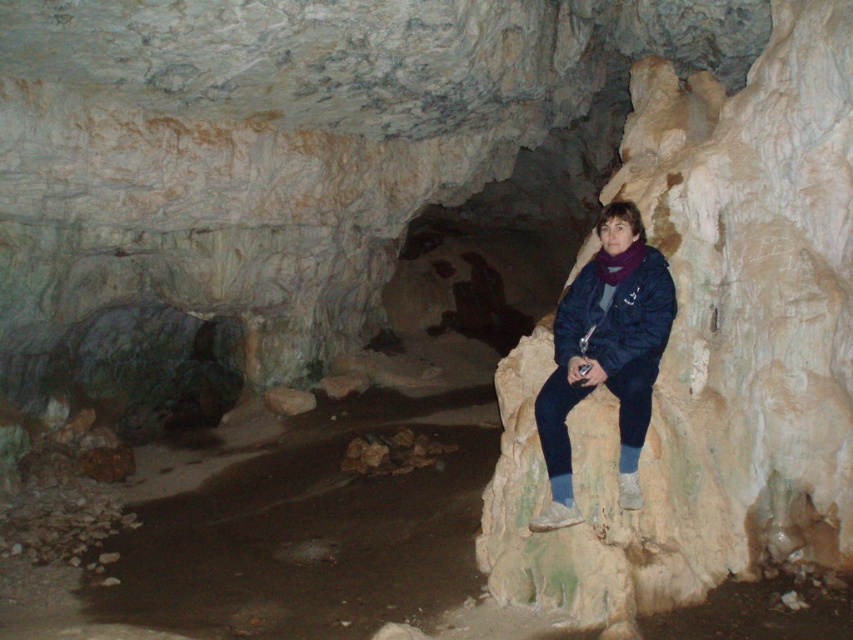
Question: Does dark blue jacket at center appear on the right side of dark blue fleece at center?

Choices:
 (A) no
 (B) yes

Answer: (A)

Question: Is dark blue jacket at center closer to the viewer compared to dark blue fleece at center?

Choices:
 (A) no
 (B) yes

Answer: (B)

Question: Which point is closer to the camera taking this photo?

Choices:
 (A) (660, 296)
 (B) (566, 288)
 (C) (730, 428)

Answer: (A)

Question: Which point is farther to the camera?

Choices:
 (A) dark blue jacket at center
 (B) dark blue fleece at center

Answer: (B)

Question: Can you confirm if white/rough rock at right is positioned below dark blue jacket at center?

Choices:
 (A) yes
 (B) no

Answer: (B)

Question: Which object is farther from the camera taking this photo?

Choices:
 (A) dark blue jacket at center
 (B) dark blue fleece at center

Answer: (B)